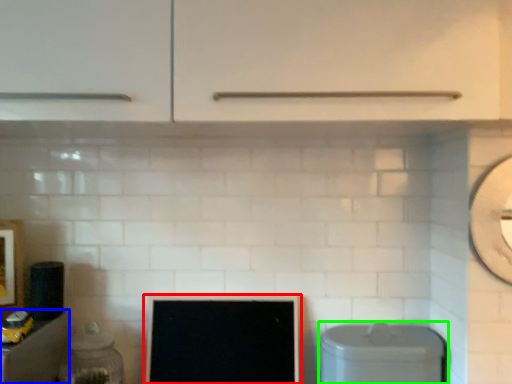
Question: Considering the real-world distances, which object is farthest from computer monitor (highlighted by a red box)? cabinetry (highlighted by a blue box) or dish washer (highlighted by a green box)?

Choices:
 (A) cabinetry
 (B) dish washer

Answer: (A)